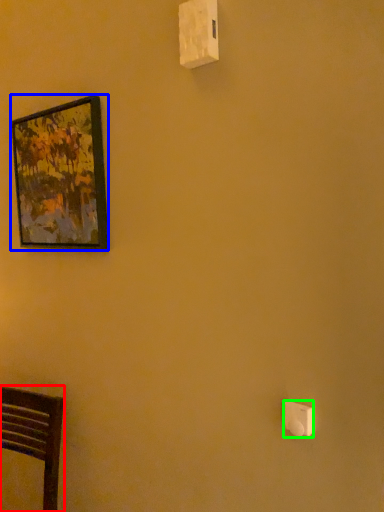
Question: Considering the real-world distances, which object is closest to furniture (highlighted by a red box)? picture frame (highlighted by a blue box) or light switch (highlighted by a green box).

Choices:
 (A) picture frame
 (B) light switch

Answer: (A)